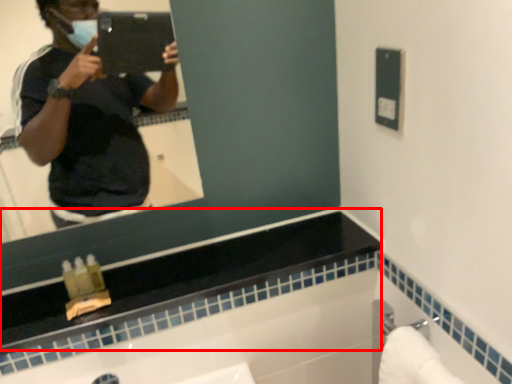
Question: From the image's perspective, what is the correct spatial relationship of counter top (annotated by the red box) in relation to towel bar?

Choices:
 (A) above
 (B) below

Answer: (A)